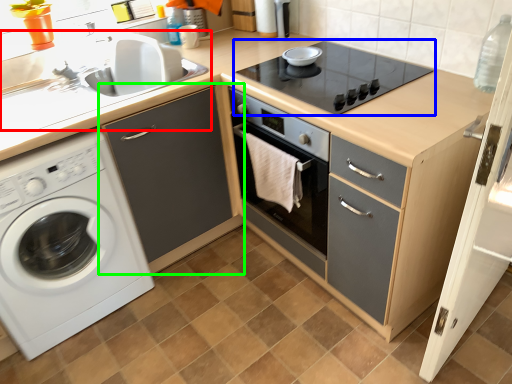
Question: Based on their relative distances, which object is farther from sink (highlighted by a red box)? Choose from gas stove (highlighted by a blue box) and cabinetry (highlighted by a green box).

Choices:
 (A) gas stove
 (B) cabinetry

Answer: (A)